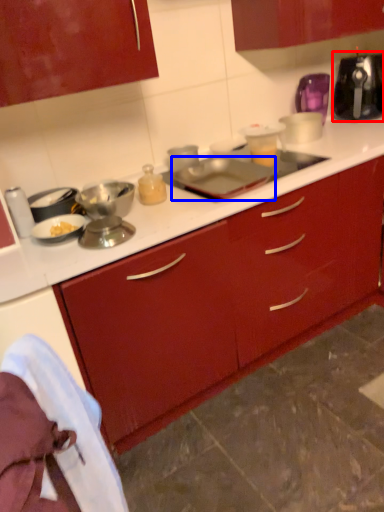
Question: Which of the following is the farthest to the observer, kitchen appliance (highlighted by a red box) or appliance (highlighted by a blue box)?

Choices:
 (A) kitchen appliance
 (B) appliance

Answer: (A)